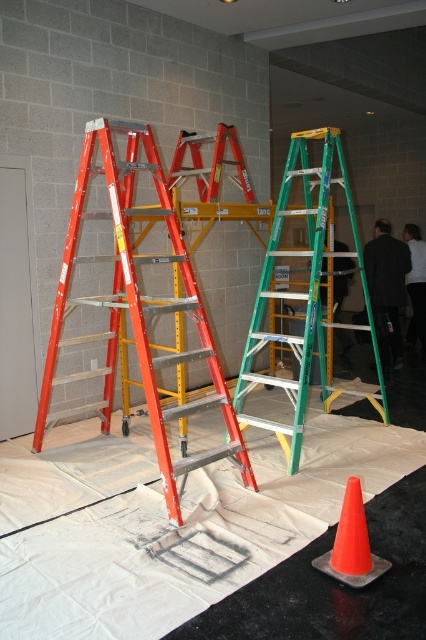
Question: Is orange fiberglass ladder at left wider than green metallic ladder at center?

Choices:
 (A) no
 (B) yes

Answer: (B)

Question: Which is nearer to the orange fiberglass ladder at left?

Choices:
 (A) orange plastic traffic cone at lower right
 (B) green metallic ladder at center

Answer: (B)

Question: Does orange fiberglass ladder at left have a smaller size compared to green metallic ladder at center?

Choices:
 (A) no
 (B) yes

Answer: (B)

Question: Among these objects, which one is nearest to the camera?

Choices:
 (A) orange plastic traffic cone at lower right
 (B) orange fiberglass ladder at left

Answer: (A)

Question: Which object is farther from the camera taking this photo?

Choices:
 (A) green metallic ladder at center
 (B) orange fiberglass ladder at left
 (C) orange plastic traffic cone at lower right

Answer: (A)

Question: Is orange fiberglass ladder at left bigger than green metallic ladder at center?

Choices:
 (A) yes
 (B) no

Answer: (B)